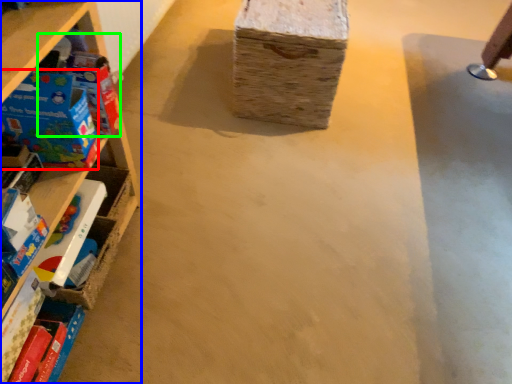
Question: Which object is the farthest from toy (highlighted by a red box)? Choose among these: shelf (highlighted by a blue box) or toy (highlighted by a green box).

Choices:
 (A) shelf
 (B) toy

Answer: (A)